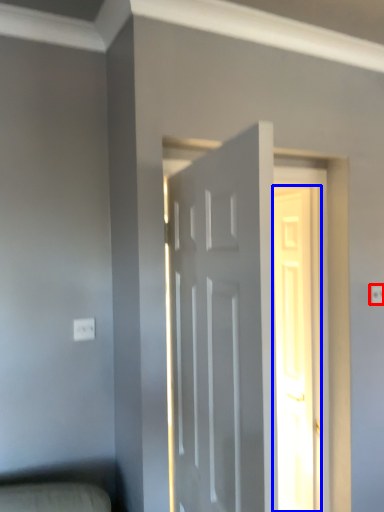
Question: Which of the following is the closest to the observer, electric outlet (highlighted by a red box) or door (highlighted by a blue box)?

Choices:
 (A) electric outlet
 (B) door

Answer: (A)